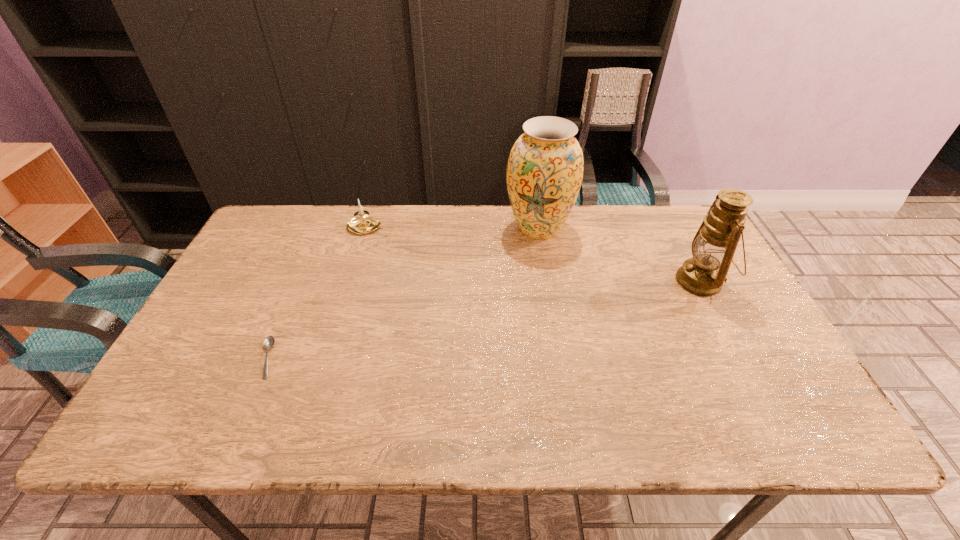
I want to click on the closest object to the candle holder, so click(x=544, y=174).

The image size is (960, 540). In order to click on vacant space that satisfies the following two spatial constraints: 1. on the back side of the vase; 2. on the right side of the shortest object in this screenshot , I will do `click(324, 228)`.

I want to click on vacant region that satisfies the following two spatial constraints: 1. on the handle side of the third object from right to left; 2. on the back side of the third object from left to right, so click(x=367, y=228).

Where is `free region that satisfies the following two spatial constraints: 1. on the handle side of the second shortest object; 2. on the back side of the rightmost object`? The height and width of the screenshot is (540, 960). free region that satisfies the following two spatial constraints: 1. on the handle side of the second shortest object; 2. on the back side of the rightmost object is located at coordinates (350, 281).

Locate an element on the screen. Image resolution: width=960 pixels, height=540 pixels. vacant point that satisfies the following two spatial constraints: 1. on the handle side of the third tallest object; 2. on the right side of the second nearest object is located at coordinates (350, 281).

In order to click on blank space that satisfies the following two spatial constraints: 1. on the handle side of the third object from left to right; 2. on the right side of the candle holder in this screenshot , I will do `click(367, 228)`.

Locate an element on the screen. The width and height of the screenshot is (960, 540). free space that satisfies the following two spatial constraints: 1. on the handle side of the third shortest object; 2. on the right side of the candle holder is located at coordinates (350, 281).

The image size is (960, 540). What are the coordinates of `vacant space that satisfies the following two spatial constraints: 1. on the front side of the second nearest object; 2. on the right side of the vase` in the screenshot? It's located at (547, 281).